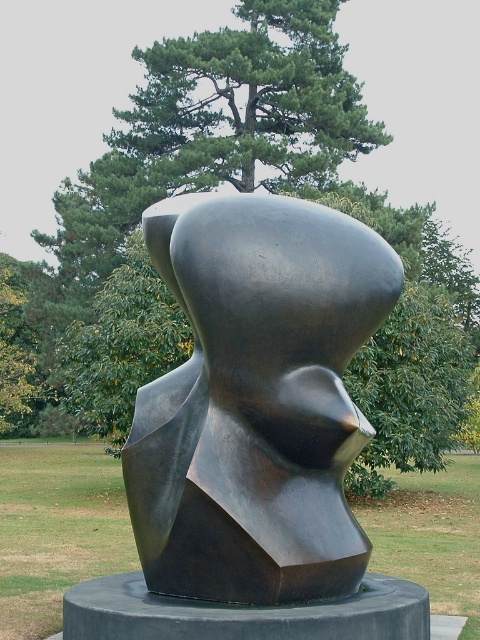
You are standing in the park and want to take a photo of the polished bronze bust at center. If you are standing at point 0, where would you need to position yourself to capture the sculpture in the frame?

The polished bronze bust at center is located at point (255, 401), so you should position yourself at that coordinate to capture it in the frame.

You are an art student analyzing the sculpture and the tree in the background. Which object is taller, the polished bronze bust at center or the green leafy tree at upper center?

The green leafy tree at upper center is taller than the polished bronze bust at center.

You are an art student standing in front of the sculpture. You need to sketch the scene, focusing on the relationship between the polished bronze bust at center and the green leafy tree at upper center. Which object is located to the left of the other?

The polished bronze bust at center is positioned on the left side of green leafy tree at upper center.